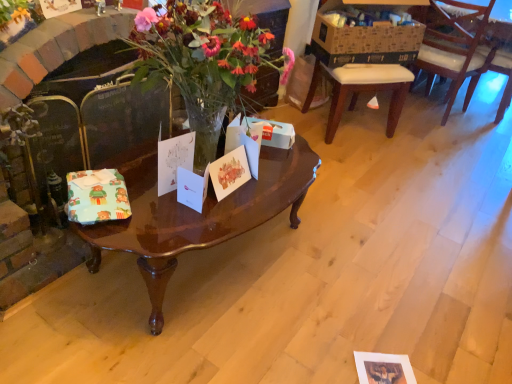
In order to click on free point to the right of white paper gift card at center, which is counted as the 2th gift card, starting from the right in this screenshot , I will do `click(237, 208)`.